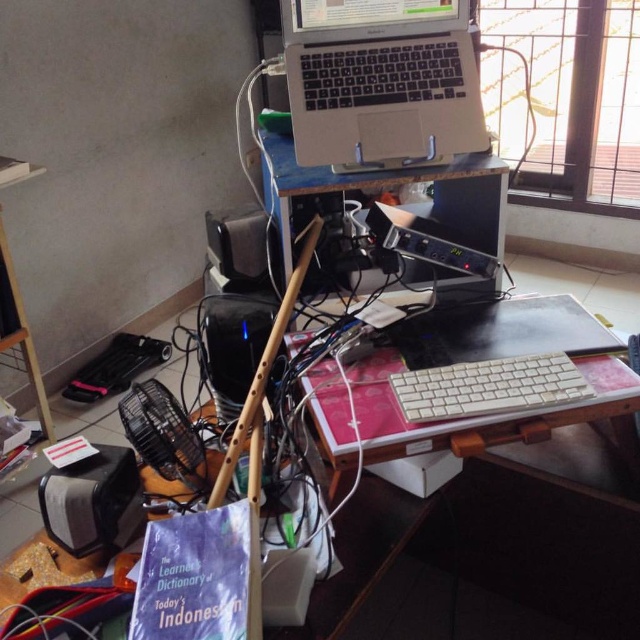
Which is in front, point (308, 42) or point (221, 214)?

Point (308, 42) is more forward.

At what (x,y) coordinates should I click in order to perform the action: click on silver metallic laptop at upper center. Please return your answer as a coordinate pair (x, y). Looking at the image, I should click on (381, 80).

At what (x,y) coordinates should I click in order to perform the action: click on silver metallic laptop at upper center. Please return your answer as a coordinate pair (x, y). This screenshot has height=640, width=640. Looking at the image, I should click on (381, 80).

Who is shorter, silver metallic laptop at upper center or black plastic speaker at lower left?

With less height is black plastic speaker at lower left.

Who is positioned more to the right, silver metallic laptop at upper center or black plastic speaker at lower left?

Positioned to the right is silver metallic laptop at upper center.

Between point (416, 88) and point (118, 451), which one is positioned in front?

Point (118, 451) is in front.

Identify the location of silver metallic laptop at upper center. (381, 80).

Can you confirm if white plastic keyboard at center is positioned below black plastic speaker at center?

Correct, white plastic keyboard at center is located below black plastic speaker at center.

Can you confirm if white plastic keyboard at center is smaller than black plastic speaker at center?

Yes.

What do you see at coordinates (486, 387) in the screenshot? This screenshot has width=640, height=640. I see `white plastic keyboard at center` at bounding box center [486, 387].

The image size is (640, 640). Find the location of `white plastic keyboard at center`. white plastic keyboard at center is located at coordinates (486, 387).